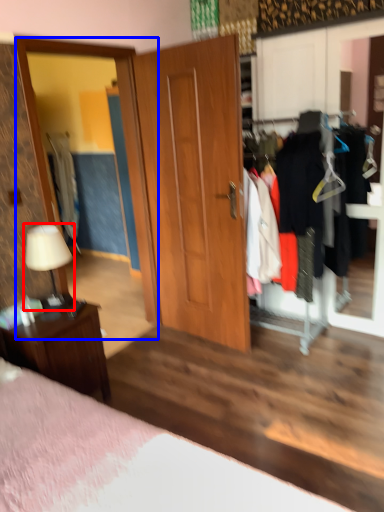
Question: Which object is further to the camera taking this photo, table lamp (highlighted by a red box) or mirror (highlighted by a blue box)?

Choices:
 (A) table lamp
 (B) mirror

Answer: (B)